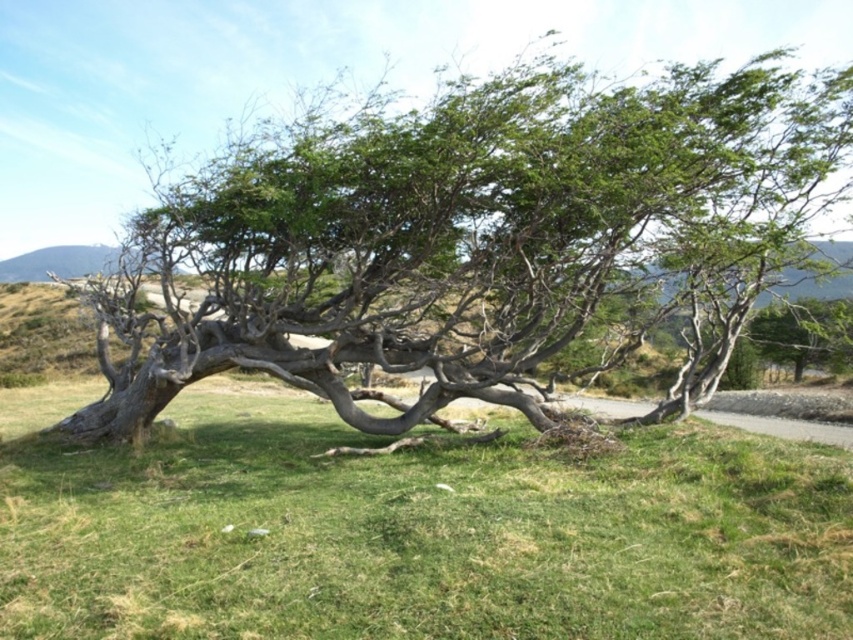
You are a hiker standing on the green grass at center and want to reach the dirt path behind the green rough bark tree at center. Which direction should you walk relative to the tree?

The green rough bark tree at center is positioned over green grass at center, so you should walk behind the green rough bark tree at center to reach the dirt path.

You are a gardener standing at the edge of the dirt path behind the green leafy tree at center. You want to plant a new flower bed in the green grass at center. Since the tree has a large canopy, will the flowers get enough sunlight?

The green grass at center is positioned under the green leafy tree at center, so the flowers may not get enough sunlight due to the tree canopy blocking direct sunlight.

You are standing at the center of the image and want to walk towards the green rough bark tree at center. In which direction should you move?

Since the green rough bark tree at center is already at the center of the image, you are already facing it. There is no need to move in any direction.